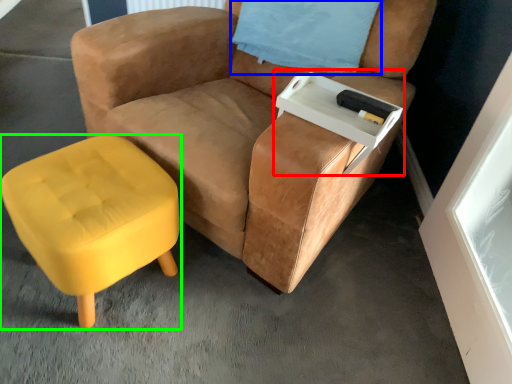
Question: Considering the real-world distances, which object is farthest from side table (highlighted by a red box)? pillow (highlighted by a blue box) or stool (highlighted by a green box)?

Choices:
 (A) pillow
 (B) stool

Answer: (B)